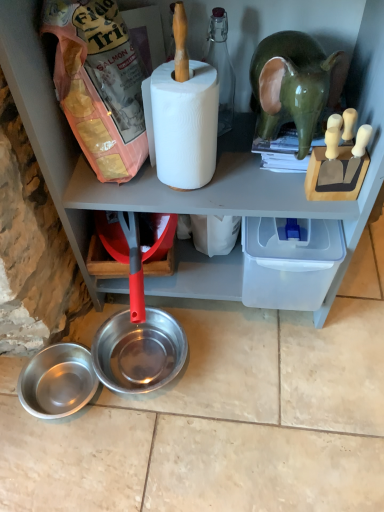
Locate an element on the screen. vacant area that is situated to the right of brushed metal bowl at lower left, the 1th bowl positioned from the left is located at coordinates (142, 430).